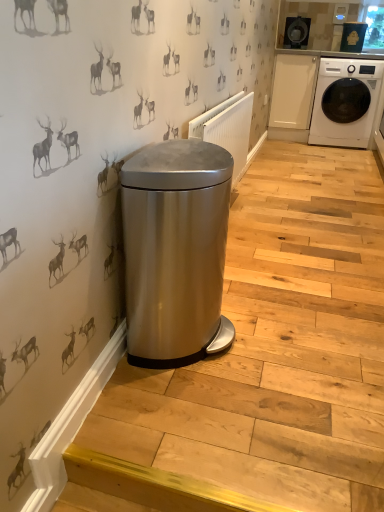
At what (x,y) coordinates should I click in order to perform the action: click on free point above stainless steel trash can at lower left (from a real-world perspective). Please return your answer as a coordinate pair (x, y). Looking at the image, I should click on (302, 222).